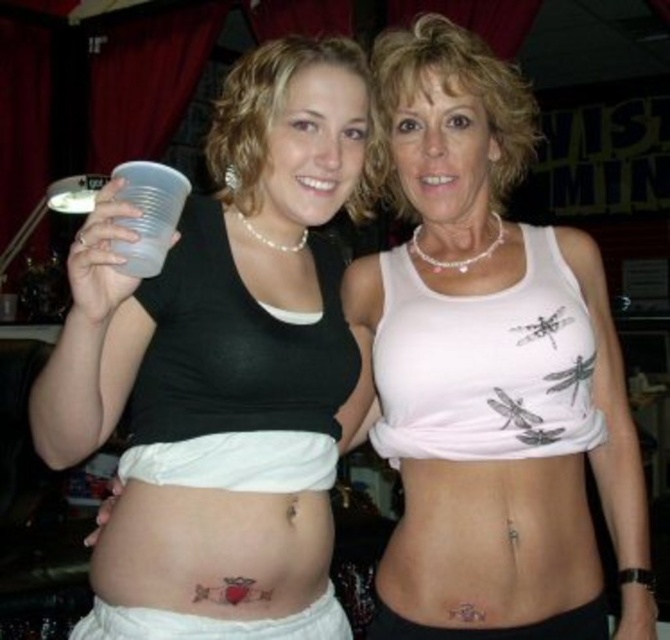
You are a fashion designer observing two tops in the image. The black matte tank top at center and the white matte bikini top at center. Which one is bigger in size?

The black matte tank top at center has a larger size compared to the white matte bikini top at center.

You are at a social event and want to take a photo of both points mentioned. Which point, point (253, 458) or point (537, 550), is closer to you?

Point (253, 458) is closer to the viewer than point (537, 550).